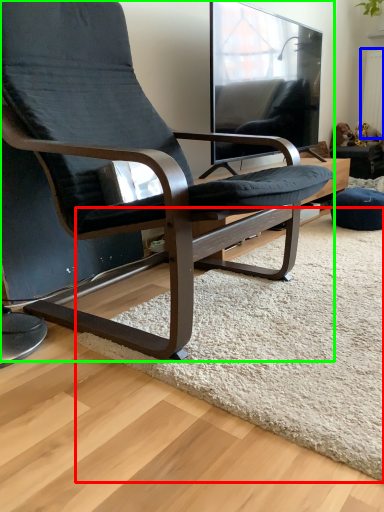
Question: Based on their relative distances, which object is nearer to mat (highlighted by a red box)? Choose from radiator (highlighted by a blue box) and chair (highlighted by a green box).

Choices:
 (A) radiator
 (B) chair

Answer: (B)